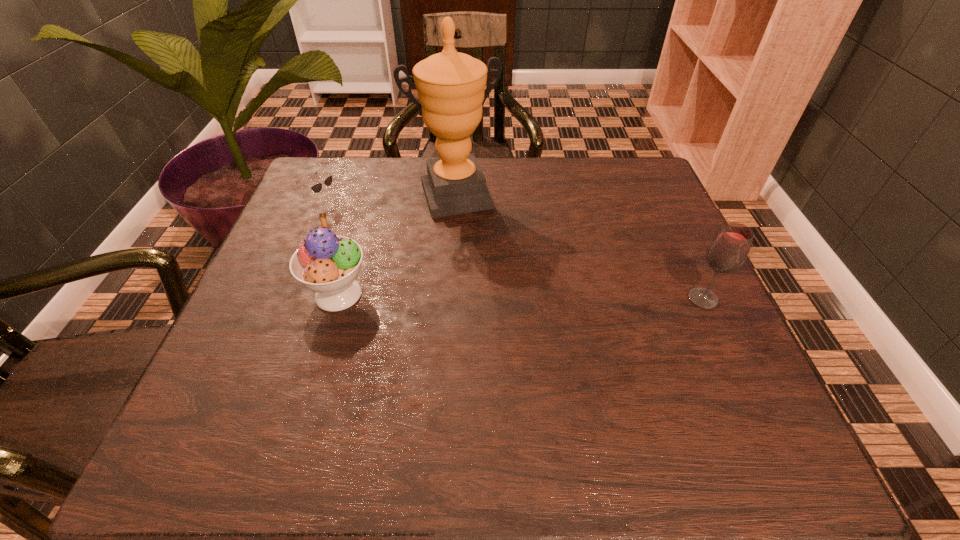
Locate an element on the screen. The height and width of the screenshot is (540, 960). free spot that satisfies the following two spatial constraints: 1. on the front side of the sunglasses; 2. on the right side of the glass drink container is located at coordinates (285, 299).